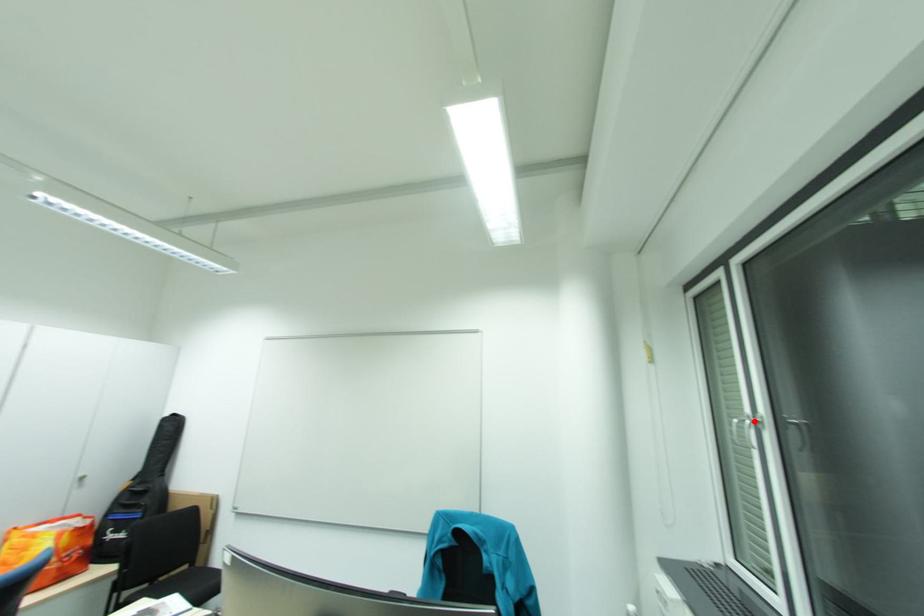
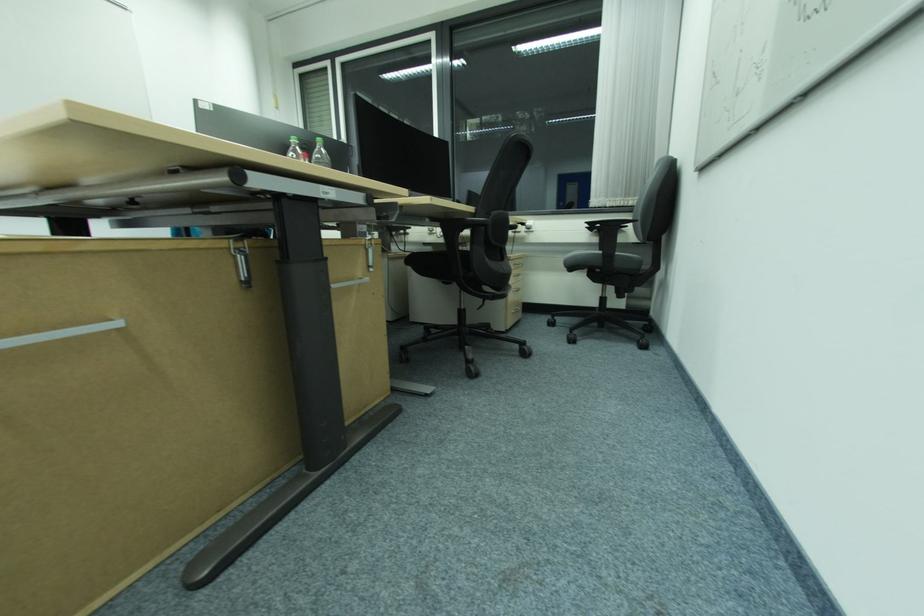
Question: I am providing you with two images of the same scene from different viewpoints. A red point is marked on the first image. Is the red point's position out of view in image 2?

Choices:
 (A) Yes
 (B) No

Answer: (A)